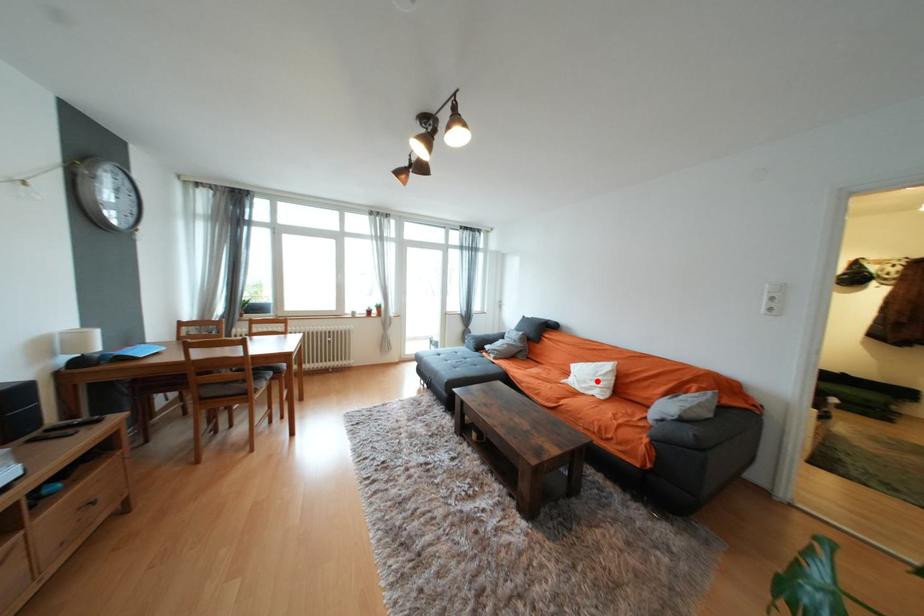
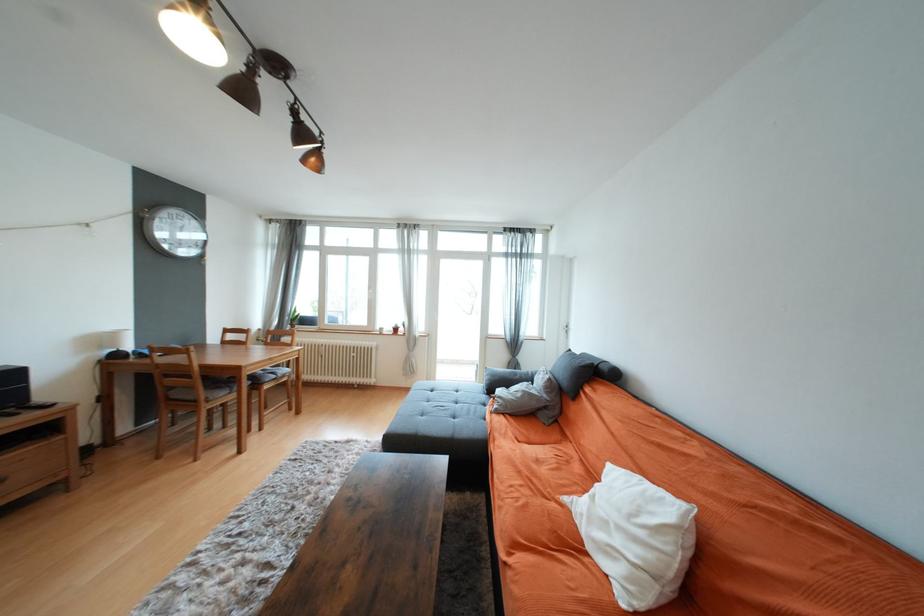
Locate, in the second image, the point that corresponds to the highlighted location in the first image.

(625, 530)